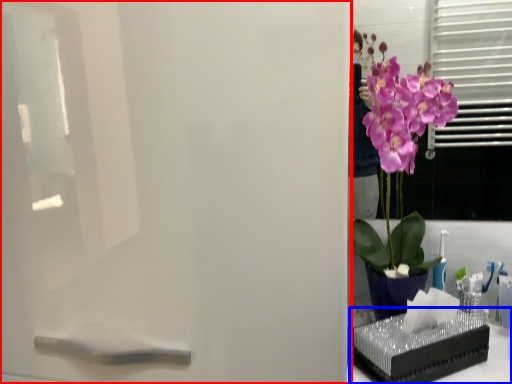
Question: Which object appears farthest to the camera in this image, screen door (highlighted by a red box) or window sill (highlighted by a blue box)?

Choices:
 (A) screen door
 (B) window sill

Answer: (B)